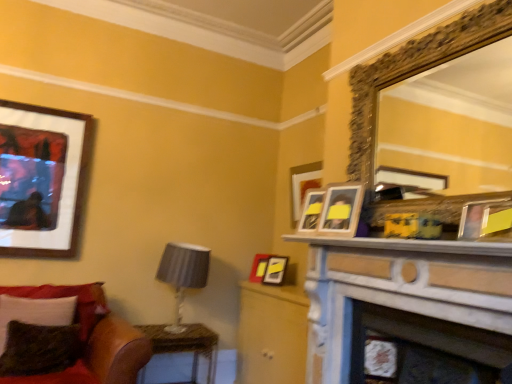
Question: Can you confirm if white marble fireplace at center is taller than matte black frame at upper left, which ranks as the 3th picture frame in front-to-back order?

Choices:
 (A) no
 (B) yes

Answer: (A)

Question: Does white marble fireplace at center have a lesser width compared to matte black frame at upper left, which is counted as the 1th picture frame, starting from the left?

Choices:
 (A) no
 (B) yes

Answer: (A)

Question: Can you confirm if white marble fireplace at center is positioned to the left of matte black frame at upper left, which is counted as the 1th picture frame, starting from the left?

Choices:
 (A) no
 (B) yes

Answer: (A)

Question: Is matte black frame at upper left, which is counted as the 1th picture frame, starting from the left, surrounded by white marble fireplace at center?

Choices:
 (A) yes
 (B) no

Answer: (B)

Question: Would you say white marble fireplace at center is a long distance from matte black frame at upper left, which is counted as the 1th picture frame, starting from the left?

Choices:
 (A) no
 (B) yes

Answer: (B)

Question: From a real-world perspective, is white marble fireplace at center beneath matte black frame at upper left, which is counted as the 1th picture frame, starting from the left?

Choices:
 (A) yes
 (B) no

Answer: (A)

Question: From the image's perspective, would you say matte wood dresser at center is positioned over velvety green pillow at lower left, which ranks as the second pillow in front-to-back order?

Choices:
 (A) no
 (B) yes

Answer: (A)

Question: Does matte wood dresser at center lie in front of velvety green pillow at lower left, which ranks as the second pillow in front-to-back order?

Choices:
 (A) yes
 (B) no

Answer: (B)

Question: Is matte wood dresser at center at the left side of velvety green pillow at lower left, which ranks as the second pillow in front-to-back order?

Choices:
 (A) yes
 (B) no

Answer: (B)

Question: Considering the relative sizes of matte wood dresser at center and velvety green pillow at lower left, positioned as the 1th pillow in back-to-front order, in the image provided, is matte wood dresser at center smaller than velvety green pillow at lower left, positioned as the 1th pillow in back-to-front order,?

Choices:
 (A) no
 (B) yes

Answer: (A)

Question: Is matte wood dresser at center oriented away from velvety green pillow at lower left, positioned as the 1th pillow in back-to-front order?

Choices:
 (A) yes
 (B) no

Answer: (B)

Question: Is matte wood dresser at center placed right next to velvety green pillow at lower left, which ranks as the second pillow in front-to-back order?

Choices:
 (A) no
 (B) yes

Answer: (A)

Question: Does gold ornate mirror at upper right appear on the left side of matte yellow picture frame at upper right, the 1th picture frame positioned from the right?

Choices:
 (A) no
 (B) yes

Answer: (B)